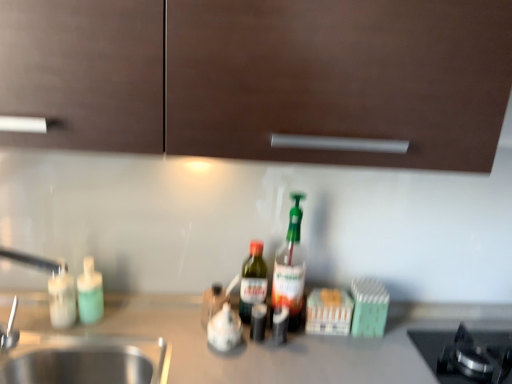
Question: Considering the relative sizes of white glossy soap dispenser at left, arranged as the first bottle when viewed from the left, and silver metallic faucet at left in the image provided, is white glossy soap dispenser at left, arranged as the first bottle when viewed from the left, bigger than silver metallic faucet at left?

Choices:
 (A) no
 (B) yes

Answer: (A)

Question: From a real-world perspective, is white glossy soap dispenser at left, placed as the fourth bottle when sorted from right to left, on top of silver metallic faucet at left?

Choices:
 (A) yes
 (B) no

Answer: (B)

Question: Does white glossy soap dispenser at left, placed as the fourth bottle when sorted from right to left, turn towards silver metallic faucet at left?

Choices:
 (A) yes
 (B) no

Answer: (A)

Question: Does white glossy soap dispenser at left, placed as the fourth bottle when sorted from right to left, have a smaller size compared to silver metallic faucet at left?

Choices:
 (A) yes
 (B) no

Answer: (A)

Question: From the image's perspective, is white glossy soap dispenser at left, placed as the fourth bottle when sorted from right to left, located above silver metallic faucet at left?

Choices:
 (A) yes
 (B) no

Answer: (B)

Question: Considering the relative sizes of translucent plastic bottle at center, the 4th bottle viewed from the left, and green glass bottle at center, the third bottle positioned from the left, in the image provided, is translucent plastic bottle at center, the 4th bottle viewed from the left, smaller than green glass bottle at center, the third bottle positioned from the left,?

Choices:
 (A) yes
 (B) no

Answer: (B)

Question: From the image's perspective, is translucent plastic bottle at center, the first bottle in the right-to-left sequence, below green glass bottle at center, which is counted as the second bottle, starting from the right?

Choices:
 (A) no
 (B) yes

Answer: (A)

Question: Does translucent plastic bottle at center, the first bottle in the right-to-left sequence, turn towards green glass bottle at center, which is counted as the second bottle, starting from the right?

Choices:
 (A) no
 (B) yes

Answer: (A)

Question: Is the depth of translucent plastic bottle at center, the first bottle in the right-to-left sequence, greater than that of green glass bottle at center, which is counted as the second bottle, starting from the right?

Choices:
 (A) yes
 (B) no

Answer: (B)

Question: From the image's perspective, does translucent plastic bottle at center, the first bottle in the right-to-left sequence, appear higher than green glass bottle at center, the third bottle positioned from the left?

Choices:
 (A) no
 (B) yes

Answer: (B)

Question: Is translucent plastic bottle at center, the 4th bottle viewed from the left, at the left side of green glass bottle at center, the third bottle positioned from the left?

Choices:
 (A) yes
 (B) no

Answer: (B)

Question: From a real-world perspective, does silver metallic faucet at left stand above green glass bottle at center, which is counted as the second bottle, starting from the right?

Choices:
 (A) yes
 (B) no

Answer: (A)